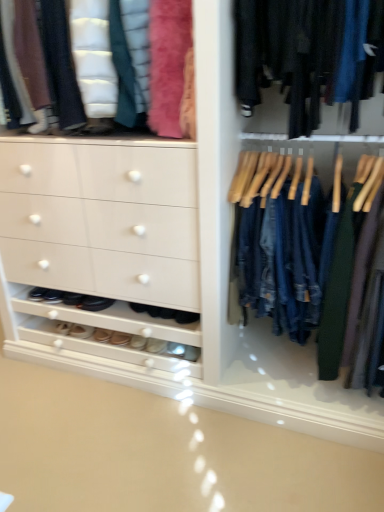
Question: From a real-world perspective, is denim jeans at center above or below white leather shoe at lower left, marked as the first footwear in a left-to-right arrangement?

Choices:
 (A) above
 (B) below

Answer: (A)

Question: Is denim jeans at center to the left or to the right of white leather shoe at lower left, marked as the first footwear in a left-to-right arrangement, in the image?

Choices:
 (A) right
 (B) left

Answer: (A)

Question: Estimate the real-world distances between objects in this image. Which object is closer to the suede beige shoe at lower center, positioned as the 1th footwear in right-to-left order?

Choices:
 (A) suede beige shoe at lower center, arranged as the fourth footwear when viewed from the right
 (B) white leather shoe at lower center, acting as the 3th footwear starting from the right
 (C) denim jeans at center
 (D) white leather shoe at lower left, marked as the sixth footwear in a right-to-left arrangement
 (E) velvet-like pink scarf at upper left

Answer: (B)

Question: Which object is the closest to the white leather shoe at lower center, acting as the 4th footwear starting from the left?

Choices:
 (A) white leather shoe at lower left, marked as the first footwear in a left-to-right arrangement
 (B) denim jeans at center
 (C) velvet-like pink scarf at upper left
 (D) black leather shoes at lower left, which ranks as the 2th footwear in left-to-right order
 (E) suede beige shoe at lower center, which is counted as the sixth footwear, starting from the left

Answer: (E)